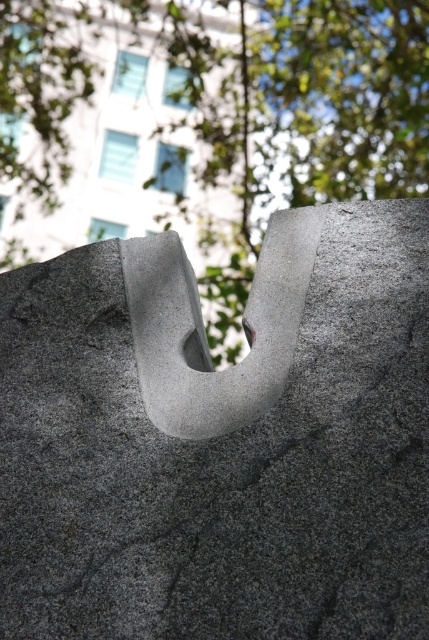
You are an architect designing a garden and want to place a new statue between the gray granite stone at center and the green leafy tree at upper center. Based on their positions, where should the statue be placed?

The gray granite stone at center is located below the green leafy tree at upper center, so the statue should be placed between them along the vertical axis, below the tree and above the stone.

You are an architect designing a new sculpture garden. You want to place a new sculpture exactly at the center of the existing gray granite stone at center. What coordinates should you use for placement?

The gray granite stone at center is located at coordinates point (220, 440), so you should place the new sculpture at point (220, 440).

You are standing in front of the sculpture and want to take a photo that includes both the gray granite stone at center and the green leafy tree at upper center. Based on their positions, which object should you focus on first to ensure both are in clear view?

You should focus on the gray granite stone at center first because it is closer to you than the green leafy tree at upper center. By focusing on the closer object, both will be in clear view due to the depth of field.